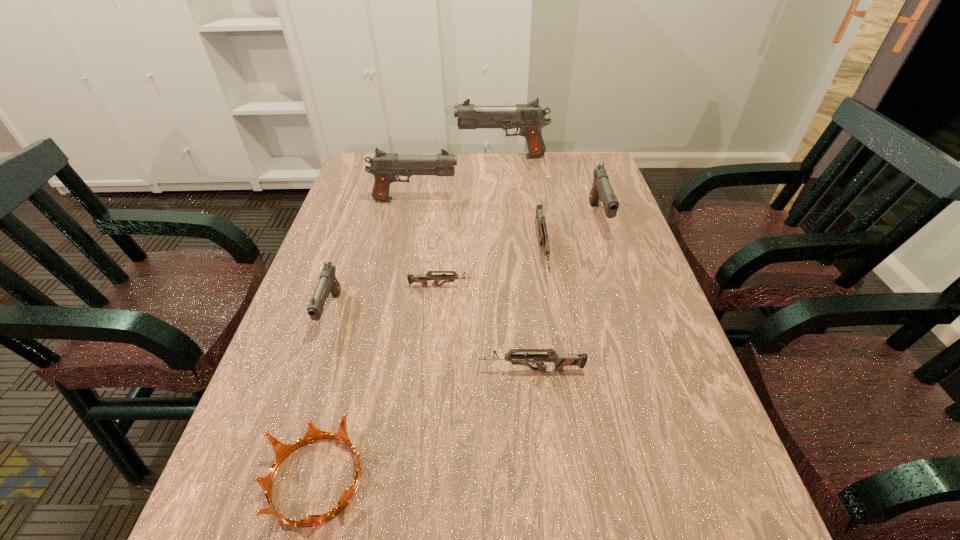
Where is `the tallest object`? The height and width of the screenshot is (540, 960). the tallest object is located at coordinates (530, 118).

Locate an element on the screen. The width and height of the screenshot is (960, 540). the biggest gray gun is located at coordinates (530, 118).

Where is `the third smallest gray gun`? This screenshot has width=960, height=540. the third smallest gray gun is located at coordinates (384, 166).

In order to click on the sixth shortest gun in this screenshot , I will do `click(384, 166)`.

This screenshot has height=540, width=960. Identify the location of the rightmost object. (601, 189).

Locate an element on the screen. the fifth shortest gun is located at coordinates click(601, 189).

Locate an element on the screen. This screenshot has width=960, height=540. the nearest gray gun is located at coordinates (328, 282).

Where is `the fourth tallest object`? Image resolution: width=960 pixels, height=540 pixels. the fourth tallest object is located at coordinates (328, 282).

Where is `the biggest grey gun`? The height and width of the screenshot is (540, 960). the biggest grey gun is located at coordinates (542, 229).

Locate an element on the screen. the nearest object is located at coordinates (281, 450).